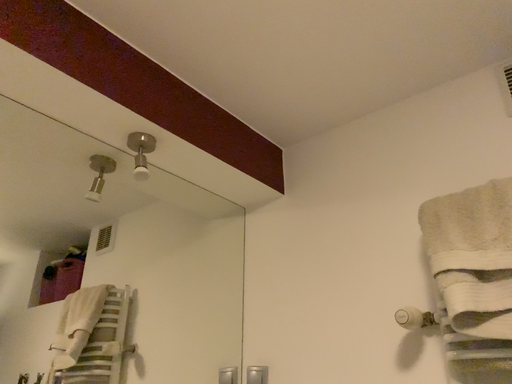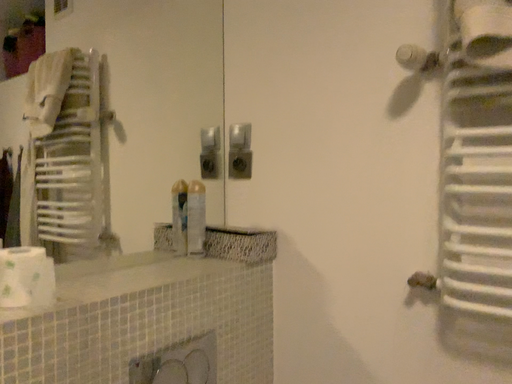
Question: How did the camera likely rotate when shooting the video?

Choices:
 (A) rotated downward
 (B) rotated upward

Answer: (A)